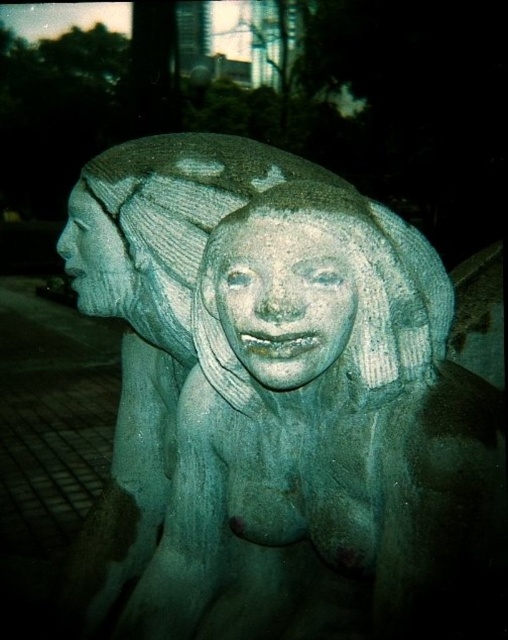
You are an art conservator examining the stone sculpture. You notice that the green stone statue at center and the slate stone face at center are part of the same sculpture. Which part of the sculpture is positioned lower?

The green stone statue at center is located below the slate stone face at center, so the green stone statue at center is positioned lower in the sculpture.